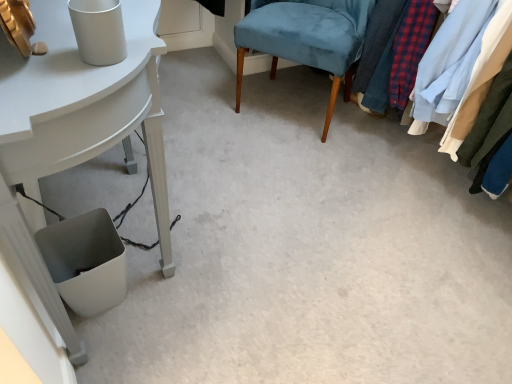
Question: From a real-world perspective, is white glossy table at lower left positioned under textured fabric clothes at right based on gravity?

Choices:
 (A) yes
 (B) no

Answer: (A)

Question: Does white glossy table at lower left turn towards textured fabric clothes at right?

Choices:
 (A) no
 (B) yes

Answer: (B)

Question: Can textured fabric clothes at right be found inside white glossy table at lower left?

Choices:
 (A) yes
 (B) no

Answer: (B)

Question: From the image's perspective, is white glossy table at lower left located beneath textured fabric clothes at right?

Choices:
 (A) yes
 (B) no

Answer: (A)

Question: From the image's perspective, would you say white glossy table at lower left is positioned over textured fabric clothes at right?

Choices:
 (A) no
 (B) yes

Answer: (A)

Question: Can you confirm if white glossy table at lower left is wider than textured fabric clothes at right?

Choices:
 (A) yes
 (B) no

Answer: (B)

Question: From the image's perspective, is velvet blue chair at center above white glossy table at lower left?

Choices:
 (A) no
 (B) yes

Answer: (B)

Question: Is velvet blue chair at center shorter than white glossy table at lower left?

Choices:
 (A) no
 (B) yes

Answer: (B)

Question: Can you confirm if velvet blue chair at center is wider than white glossy table at lower left?

Choices:
 (A) no
 (B) yes

Answer: (B)

Question: From the image's perspective, is velvet blue chair at center under white glossy table at lower left?

Choices:
 (A) yes
 (B) no

Answer: (B)

Question: Is there a large distance between velvet blue chair at center and white glossy table at lower left?

Choices:
 (A) yes
 (B) no

Answer: (B)

Question: Can you confirm if velvet blue chair at center is bigger than white glossy table at lower left?

Choices:
 (A) yes
 (B) no

Answer: (B)

Question: Is textured fabric clothes at right further to camera compared to velvet blue chair at center?

Choices:
 (A) yes
 (B) no

Answer: (B)